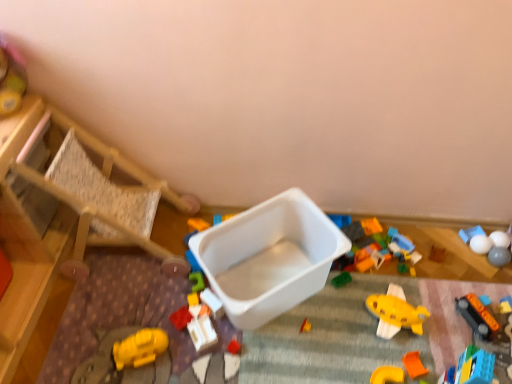
The width and height of the screenshot is (512, 384). I want to click on vacant area situated to the left side of white plastic container at center, which is counted as the 12th toy, starting from the right, so click(x=156, y=329).